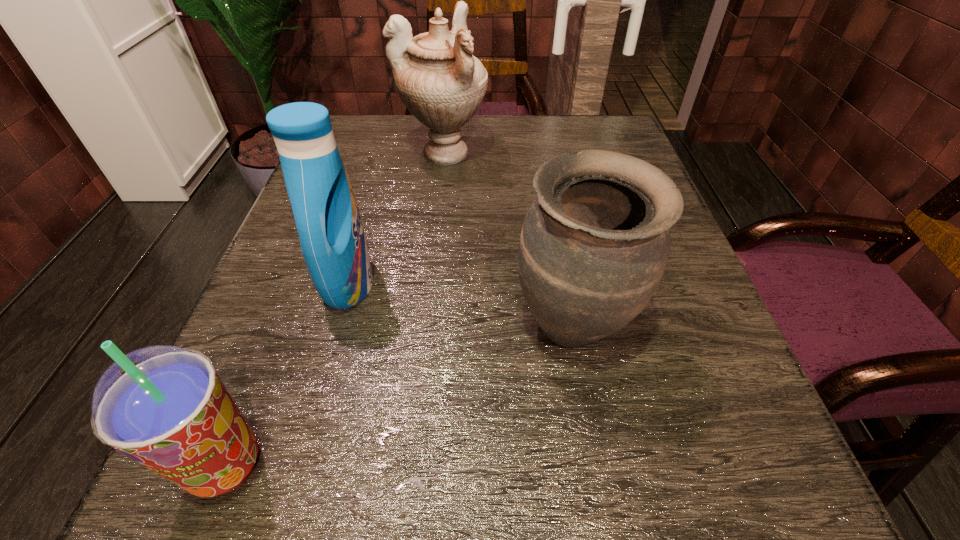
Identify the location of free space at the far left corner. This screenshot has width=960, height=540. (385, 136).

Where is `blank space at the far right corner of the desktop`? This screenshot has height=540, width=960. blank space at the far right corner of the desktop is located at coordinates (588, 113).

Identify the location of free point at the near right corner. (690, 484).

Identify the location of vacant space that's between the detergent and the left urn. [396, 218].

Where is `vacant area that lies between the left urn and the smoothie`? This screenshot has width=960, height=540. vacant area that lies between the left urn and the smoothie is located at coordinates 335,309.

What are the coordinates of `free space that is in between the smoothie and the detergent` in the screenshot? It's located at (287, 374).

Identify the location of unoccupied position between the detergent and the smoothie. (287, 374).

The width and height of the screenshot is (960, 540). I want to click on free point between the detergent and the nearest object, so click(x=287, y=374).

This screenshot has width=960, height=540. Identify the location of vacant space that's between the smoothie and the farthest object. (335, 309).

Identify the location of unoccupied position between the detergent and the smoothie. (287, 374).